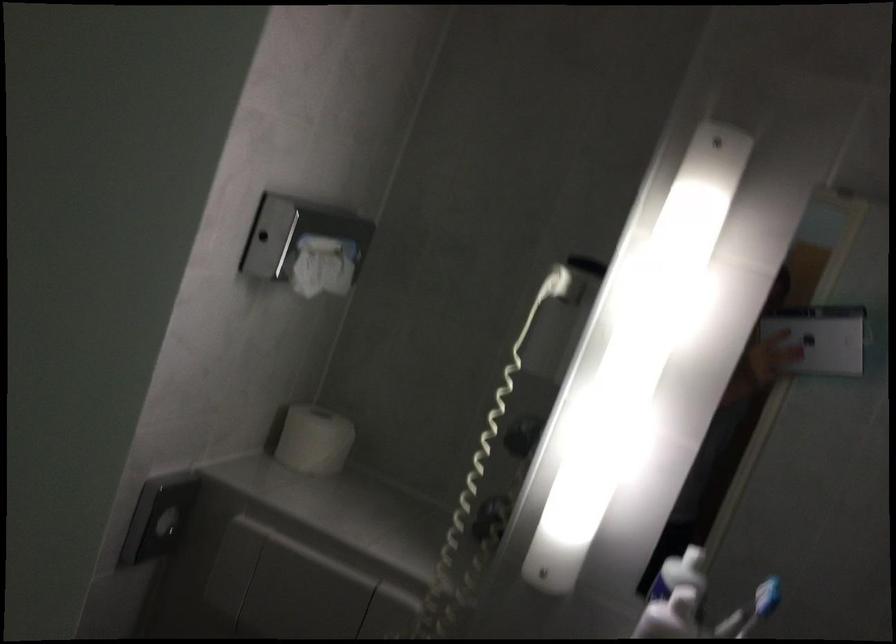
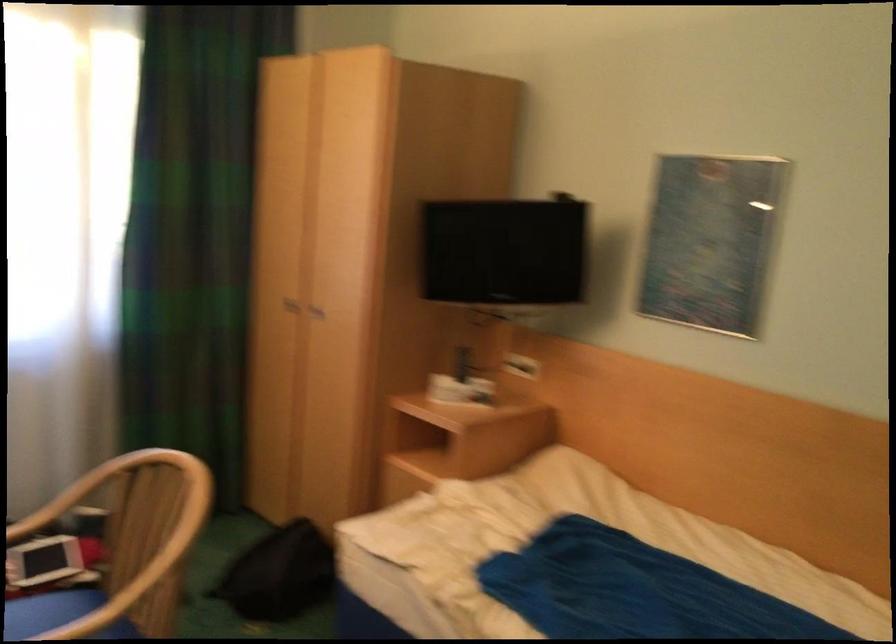
Question: In a continuous first-person perspective shot, in which direction is the camera moving?

Choices:
 (A) Left
 (B) Right
 (C) Forward
 (D) Backward

Answer: (A)